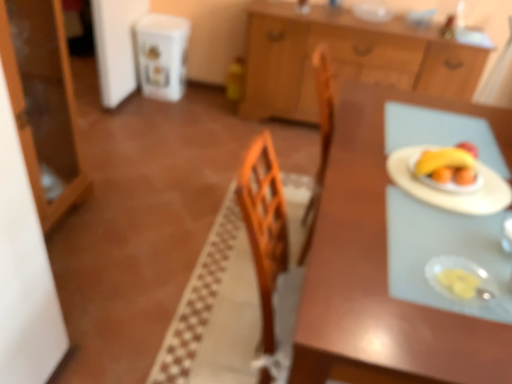
Question: Considering the relative sizes of wooden cabinet at upper center, the second cabinetry from the front, and wooden table at center in the image provided, is wooden cabinet at upper center, the second cabinetry from the front, wider than wooden table at center?

Choices:
 (A) yes
 (B) no

Answer: (B)

Question: Is wooden cabinet at upper center, arranged as the 2th cabinetry when viewed from the left, facing towards wooden table at center?

Choices:
 (A) yes
 (B) no

Answer: (A)

Question: From a real-world perspective, is wooden cabinet at upper center, the 1th cabinetry in the right-to-left sequence, physically below wooden table at center?

Choices:
 (A) yes
 (B) no

Answer: (B)

Question: Can you confirm if wooden cabinet at upper center, the 1th cabinetry in the right-to-left sequence, is positioned to the right of wooden table at center?

Choices:
 (A) no
 (B) yes

Answer: (B)

Question: Is wooden cabinet at upper center, the second cabinetry from the front, shorter than wooden table at center?

Choices:
 (A) yes
 (B) no

Answer: (B)

Question: Does point (420, 193) appear closer or farther from the camera than point (385, 13)?

Choices:
 (A) farther
 (B) closer

Answer: (B)

Question: Is white paper plate at right taller or shorter than clear glass bowl at upper center, arranged as the first tableware when viewed from the top?

Choices:
 (A) tall
 (B) short

Answer: (B)

Question: In terms of width, does white paper plate at right look wider or thinner when compared to clear glass bowl at upper center, arranged as the first tableware when viewed from the top?

Choices:
 (A) thin
 (B) wide

Answer: (B)

Question: Considering their positions, is white paper plate at right located in front of or behind clear glass bowl at upper center, the first tableware viewed from the right?

Choices:
 (A) behind
 (B) front

Answer: (B)

Question: From their relative heights in the image, would you say wooden cabinet at upper center, the second cabinetry from the front, is taller or shorter than yellow matte bananas at right?

Choices:
 (A) tall
 (B) short

Answer: (A)

Question: Considering the positions of wooden cabinet at upper center, which appears as the 1th cabinetry when viewed from the back, and yellow matte bananas at right in the image, is wooden cabinet at upper center, which appears as the 1th cabinetry when viewed from the back, wider or thinner than yellow matte bananas at right?

Choices:
 (A) thin
 (B) wide

Answer: (B)

Question: Which is correct: wooden cabinet at upper center, arranged as the 2th cabinetry when viewed from the left, is inside yellow matte bananas at right, or outside of it?

Choices:
 (A) outside
 (B) inside

Answer: (A)

Question: Considering the relative positions of wooden cabinet at upper center, arranged as the 2th cabinetry when viewed from the left, and yellow matte bananas at right in the image provided, is wooden cabinet at upper center, arranged as the 2th cabinetry when viewed from the left, to the left or to the right of yellow matte bananas at right?

Choices:
 (A) left
 (B) right

Answer: (B)

Question: Based on their positions, is matte wood cabinet at left, which is the 1th cabinetry in left-to-right order, located to the left or right of translucent plastic plate at right, which is the 2th tableware in top-to-bottom order?

Choices:
 (A) right
 (B) left

Answer: (B)

Question: From the image's perspective, is matte wood cabinet at left, the 1th cabinetry in the front-to-back sequence, located above or below translucent plastic plate at right, placed as the first tableware when sorted from bottom to top?

Choices:
 (A) below
 (B) above

Answer: (B)